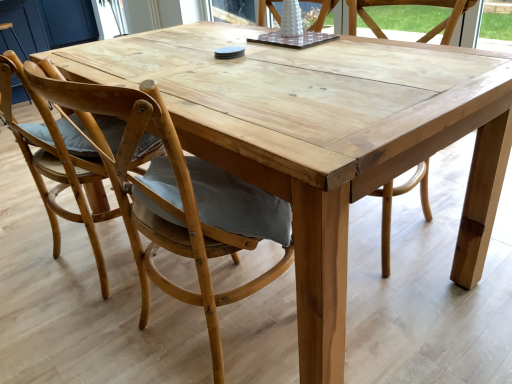
Question: Does white matte vase at upper center, which is the second chair in right-to-left order, have a larger size compared to natural wood chair at center, which is counted as the 1th chair, starting from the right?

Choices:
 (A) yes
 (B) no

Answer: (B)

Question: Can you confirm if white matte vase at upper center, the 3th chair when ordered from left to right, is thinner than natural wood chair at center, which is counted as the 1th chair, starting from the right?

Choices:
 (A) yes
 (B) no

Answer: (A)

Question: From the image's perspective, is white matte vase at upper center, which is the second chair in right-to-left order, under natural wood chair at center, which is counted as the 1th chair, starting from the right?

Choices:
 (A) yes
 (B) no

Answer: (B)

Question: Considering the relative sizes of white matte vase at upper center, which is the second chair in right-to-left order, and natural wood chair at center, which ranks as the 4th chair in left-to-right order, in the image provided, is white matte vase at upper center, which is the second chair in right-to-left order, shorter than natural wood chair at center, which ranks as the 4th chair in left-to-right order,?

Choices:
 (A) yes
 (B) no

Answer: (A)

Question: Does white matte vase at upper center, which is the second chair in right-to-left order, have a greater width compared to natural wood chair at center, which ranks as the 4th chair in left-to-right order?

Choices:
 (A) no
 (B) yes

Answer: (A)

Question: From a real-world perspective, is white matte vase at upper center, the 3th chair when ordered from left to right, positioned above or below natural wood chair at center, which ranks as the 4th chair in left-to-right order?

Choices:
 (A) below
 (B) above

Answer: (B)

Question: Considering the positions of white matte vase at upper center, the 3th chair when ordered from left to right, and natural wood chair at center, which ranks as the 4th chair in left-to-right order, in the image, is white matte vase at upper center, the 3th chair when ordered from left to right, bigger or smaller than natural wood chair at center, which ranks as the 4th chair in left-to-right order,?

Choices:
 (A) small
 (B) big

Answer: (A)

Question: Considering the relative positions of white matte vase at upper center, which is the second chair in right-to-left order, and natural wood chair at center, which ranks as the 4th chair in left-to-right order, in the image provided, is white matte vase at upper center, which is the second chair in right-to-left order, to the left or to the right of natural wood chair at center, which ranks as the 4th chair in left-to-right order,?

Choices:
 (A) left
 (B) right

Answer: (A)

Question: Considering the positions of white matte vase at upper center, which is the second chair in right-to-left order, and natural wood chair at center, which is counted as the 1th chair, starting from the right, in the image, is white matte vase at upper center, which is the second chair in right-to-left order, wider or thinner than natural wood chair at center, which is counted as the 1th chair, starting from the right,?

Choices:
 (A) wide
 (B) thin

Answer: (B)

Question: Do you think natural wood chair at center, placed as the second chair when sorted from left to right, is within natural wood chair at center, which ranks as the 4th chair in left-to-right order, or outside of it?

Choices:
 (A) outside
 (B) inside

Answer: (A)

Question: Considering the positions of point (157, 215) and point (384, 36), is point (157, 215) closer or farther from the camera than point (384, 36)?

Choices:
 (A) closer
 (B) farther

Answer: (A)

Question: From the image's perspective, is natural wood chair at center, placed as the second chair when sorted from left to right, located above or below natural wood chair at center, which ranks as the 4th chair in left-to-right order?

Choices:
 (A) above
 (B) below

Answer: (B)

Question: Is natural wood chair at center, placed as the second chair when sorted from left to right, wider or thinner than natural wood chair at center, which ranks as the 4th chair in left-to-right order?

Choices:
 (A) thin
 (B) wide

Answer: (B)

Question: Considering the positions of point [261, 16] and point [65, 218], is point [261, 16] closer or farther from the camera than point [65, 218]?

Choices:
 (A) farther
 (B) closer

Answer: (A)

Question: From a real-world perspective, is white matte vase at upper center, which is the second chair in right-to-left order, above or below light brown wood chair at left, acting as the 1th chair starting from the left?

Choices:
 (A) above
 (B) below

Answer: (A)